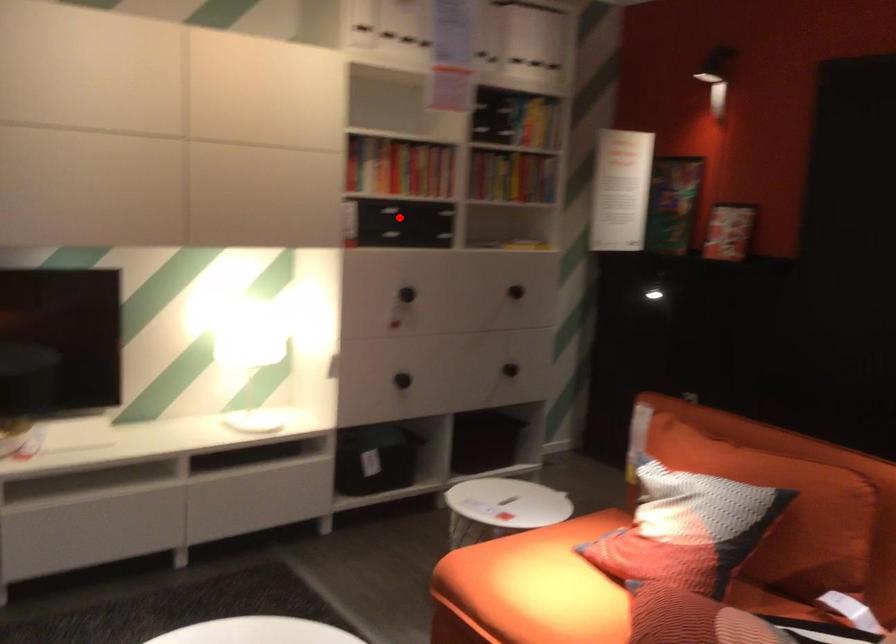
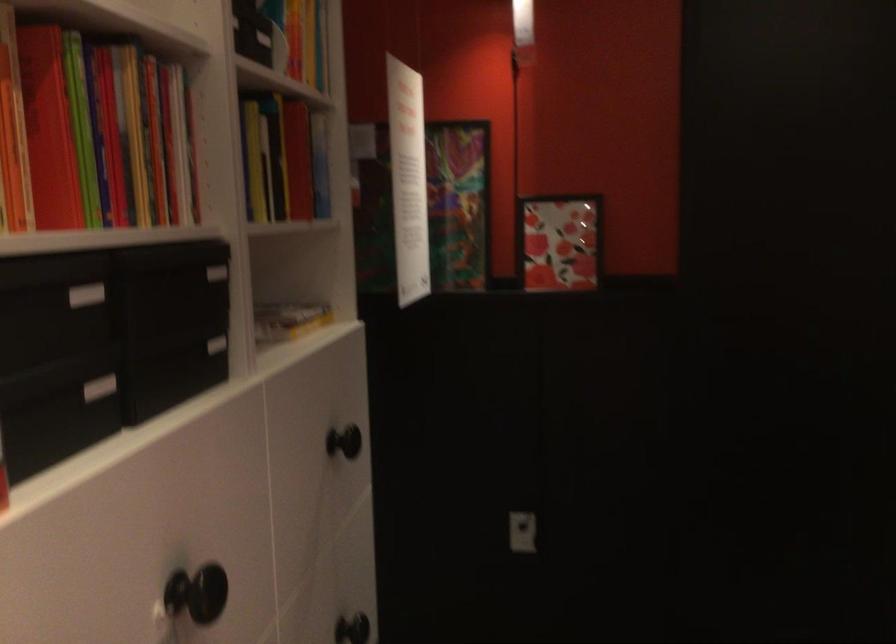
Question: I am providing you with two images of the same scene from different viewpoints. Image1 has a red point marked. In image2, the corresponding 3D location appears at what relative position? Reply with the corresponding letter.

Choices:
 (A) Closer
 (B) Farther

Answer: (A)